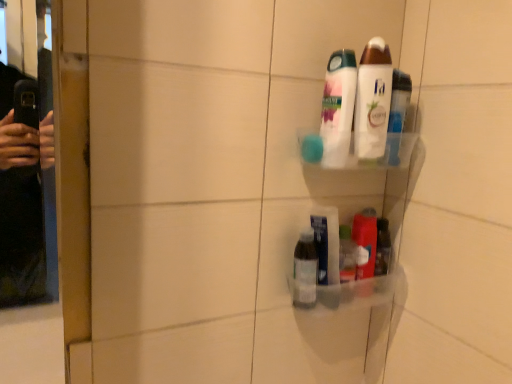
Question: From a real-world perspective, is white glossy lotion at upper center, the 4th toiletry ordered from the bottom, positioned above or below translucent plastic container at lower right, the 2th toiletry ordered from the bottom?

Choices:
 (A) below
 (B) above

Answer: (B)

Question: In the image, is white glossy lotion at upper center, the 4th toiletry ordered from the bottom, on the left side or the right side of translucent plastic container at lower right, the 2th toiletry ordered from the bottom?

Choices:
 (A) right
 (B) left

Answer: (B)

Question: Which is farther from the transparent plastic bottle at lower center?

Choices:
 (A) white glossy lotion at upper center, the 4th toiletry ordered from the bottom
 (B) translucent plastic container at lower right, which ranks as the 3th toiletry in top-to-bottom order
 (C) clear plastic bottle at lower center, the 4th toiletry in the top-to-bottom sequence
 (D) white glossy body wash at upper center, marked as the 3th toiletry in a bottom-to-top arrangement

Answer: (A)

Question: Which object is the closest to the white glossy lotion at upper center, which is the 1th toiletry from top to bottom?

Choices:
 (A) transparent plastic bottle at lower center
 (B) translucent plastic container at lower right, the 2th toiletry ordered from the bottom
 (C) white glossy body wash at upper center, marked as the 3th toiletry in a bottom-to-top arrangement
 (D) clear plastic bottle at lower center, marked as the first toiletry in a bottom-to-top arrangement

Answer: (C)